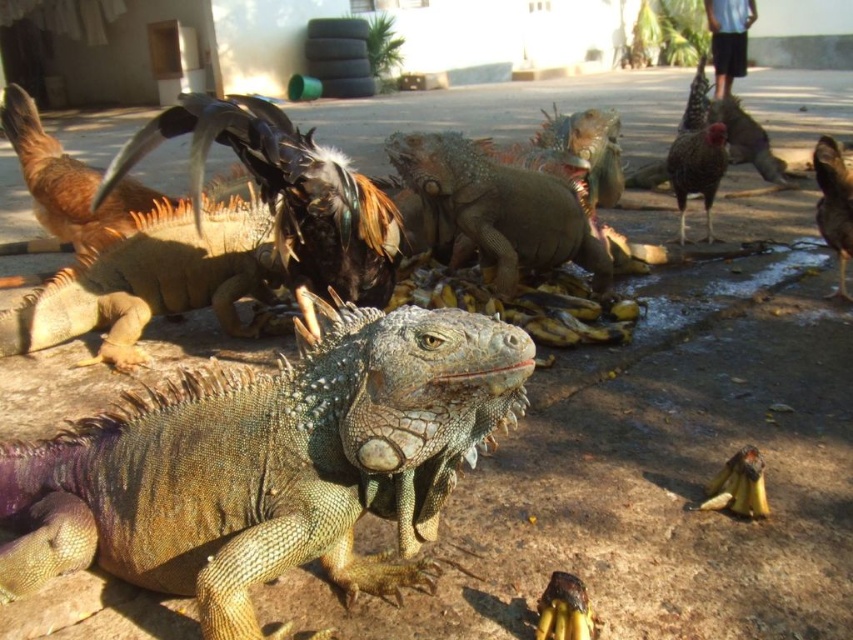
Is green scaly lizard at center above shiny brown feathers at right?

Incorrect, green scaly lizard at center is not positioned above shiny brown feathers at right.

Which is in front, point (180, 392) or point (839, 180)?

Positioned in front is point (180, 392).

Is point (430, 394) less distant than point (838, 284)?

Yes.

In order to click on green scaly lizard at center in this screenshot , I will do `click(270, 465)`.

Is shiny black feathers at center bigger than shiny brown feathers at right?

Correct, shiny black feathers at center is larger in size than shiny brown feathers at right.

Is point (392, 241) less distant than point (833, 182)?

Yes, point (392, 241) is closer to viewer.

Is point (312, 256) more distant than point (830, 150)?

That is False.

This screenshot has width=853, height=640. I want to click on shiny black feathers at center, so click(x=287, y=195).

Is green scaly iguana at center smaller than speckled feathered rooster at right?

Incorrect, green scaly iguana at center is not smaller in size than speckled feathered rooster at right.

Based on the photo, is green scaly iguana at center taller than speckled feathered rooster at right?

In fact, green scaly iguana at center may be shorter than speckled feathered rooster at right.

Describe the element at coordinates (500, 208) in the screenshot. I see `green scaly iguana at center` at that location.

The height and width of the screenshot is (640, 853). In order to click on green scaly iguana at center in this screenshot , I will do `click(500, 208)`.